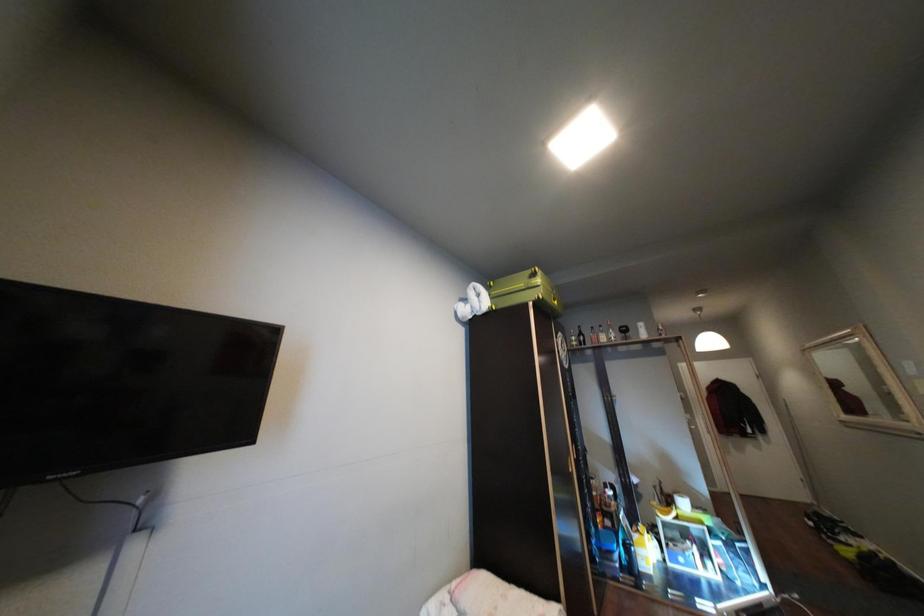
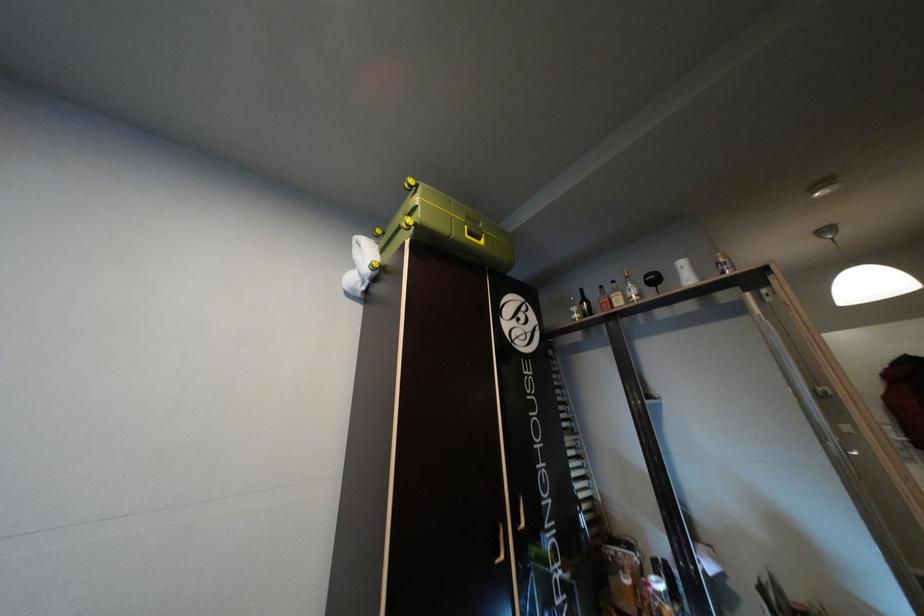
What movement of the cameraman would produce the second image?

The movement direction of the cameraman is right, forward.